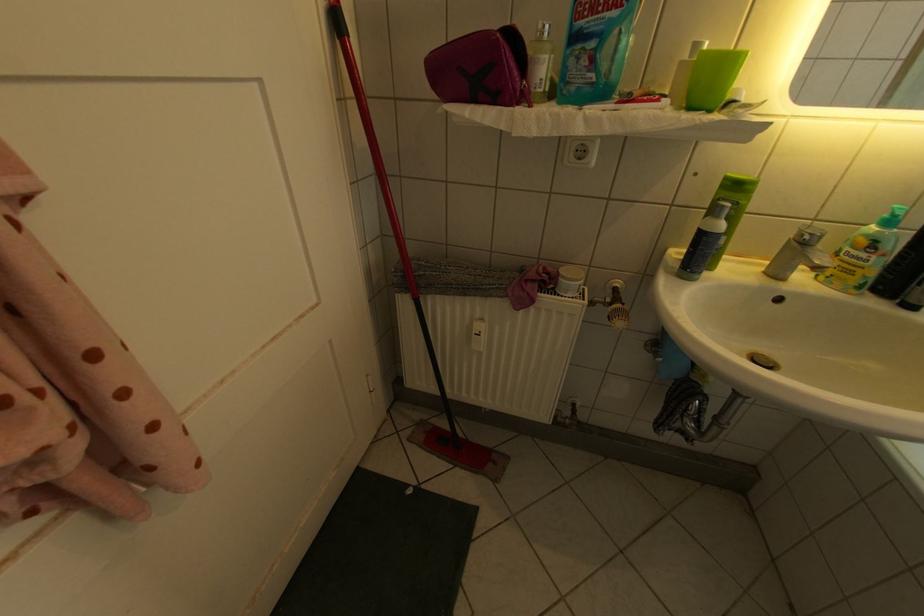
What do you see at coordinates (521, 95) in the screenshot? The image size is (924, 616). I see `the pink bag zipper` at bounding box center [521, 95].